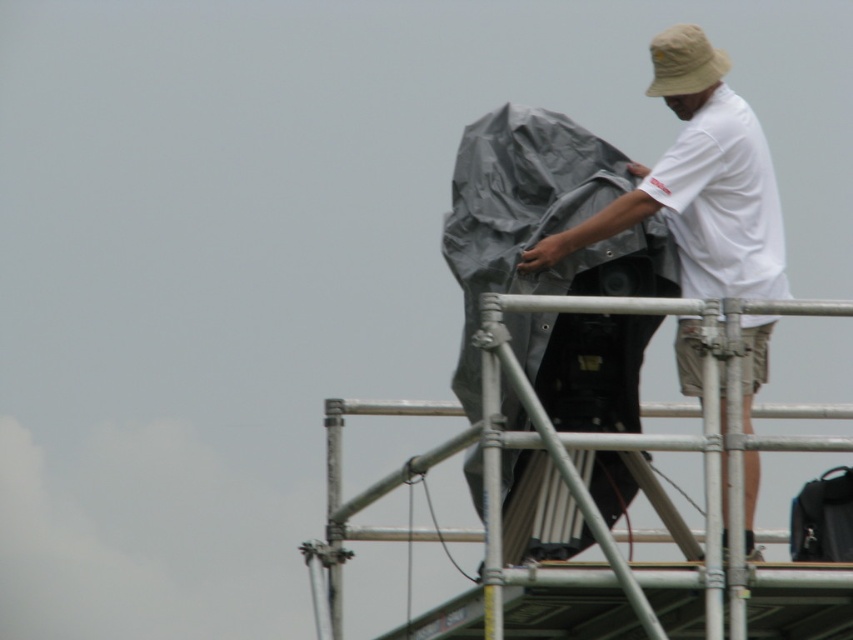
You are standing at the bottom of the silver metallic scaffolding at upper center. Looking up, you notice a point marked at coordinates 0.703 on the x and 0.713 on the y. What is the significance of this point on the scaffolding?

The point at coordinates 0.703 on the x and 0.713 on the y marks the location of the silver metallic scaffolding at upper center where the person is standing.

You are a worker on the scaffolding and need to reach the black fabric bag at upper right. Which direction should you move from the silver metallic scaffolding at upper center?

The silver metallic scaffolding at upper center is positioned on the left side of the black fabric bag at upper right, so you should move to the right to reach it.

You are a safety inspector checking the work site depicted in the image. You notice the silver metallic scaffolding at upper center and the white cotton shirt at upper right. According to safety protocols, workers must be positioned above the scaffolding to ensure visibility. Is the worker complying with this rule?

The silver metallic scaffolding at upper center is located below the white cotton shirt at upper right, which means the worker is positioned above the scaffolding. Therefore, the worker is complying with the safety protocol requirement of being above the scaffolding for visibility.